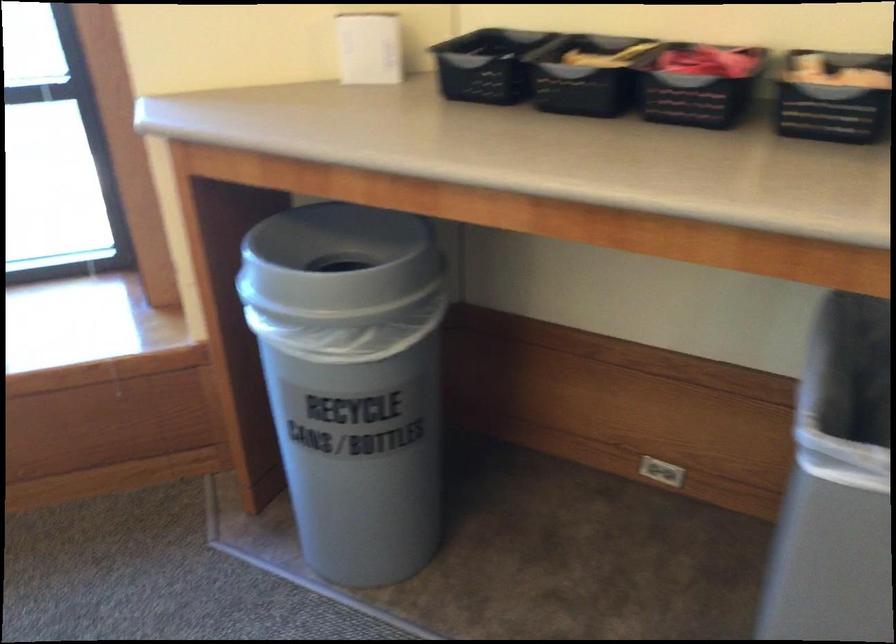
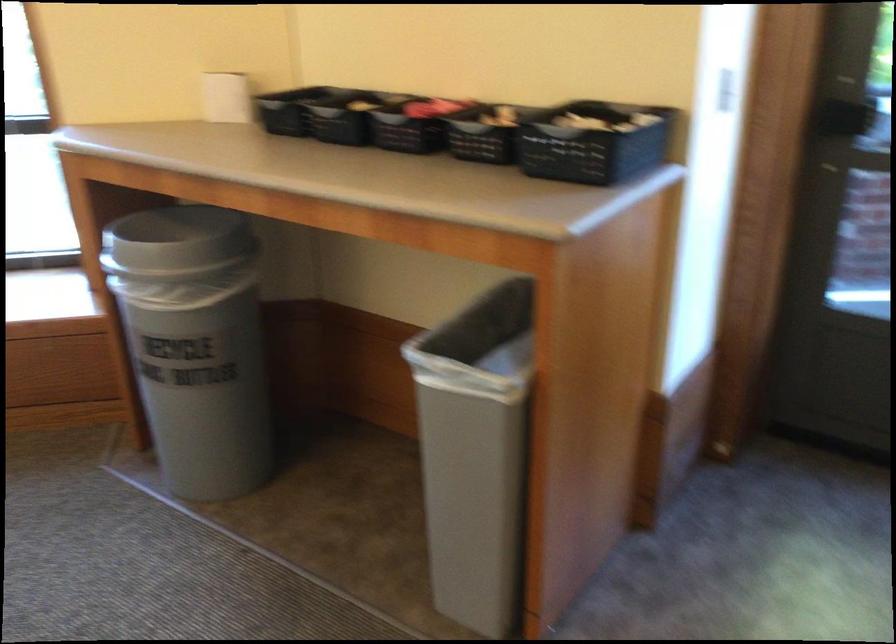
The point at (x=376, y=397) is marked in the first image. Where is the corresponding point in the second image?

(194, 344)